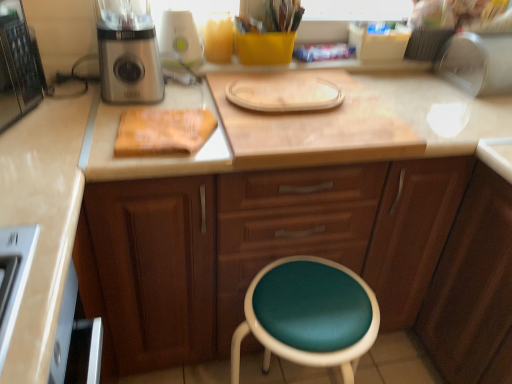
Question: Considering their positions, is wooden cutting board at center located in front of or behind teal leather stool at lower center?

Choices:
 (A) front
 (B) behind

Answer: (B)

Question: Is wooden cutting board at center taller or shorter than teal leather stool at lower center?

Choices:
 (A) short
 (B) tall

Answer: (A)

Question: Based on their relative distances, which object is nearer to the metallic silver appliance at upper right, acting as the first appliance starting from the right?

Choices:
 (A) wooden cutting board at center
 (B) white plastic blender at upper center, positioned as the 2th appliance in right-to-left order
 (C) wooden cabinet at center
 (D) satin silver blender at left
 (E) teal leather stool at lower center

Answer: (A)

Question: Which object is positioned farthest from the wooden cutting board at center?

Choices:
 (A) metallic silver appliance at upper right, acting as the first appliance starting from the right
 (B) wooden cabinet at center
 (C) white plastic blender at upper center, placed as the 1th appliance when sorted from left to right
 (D) teal leather stool at lower center
 (E) satin silver blender at left

Answer: (A)